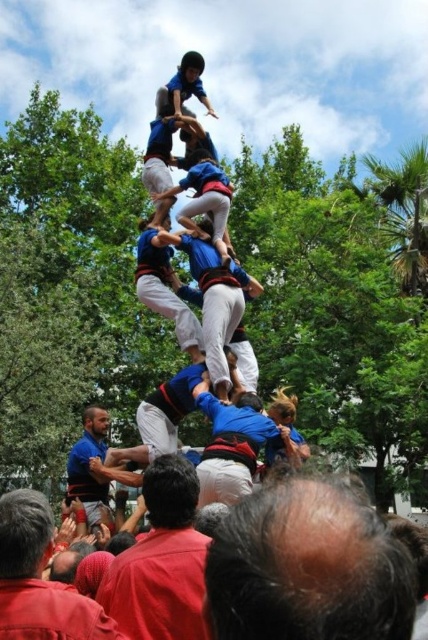
Describe the element at coordinates (162, 561) in the screenshot. This screenshot has width=428, height=640. I see `dark blue shirt at center` at that location.

Is dark blue shirt at center above red shirt at lower left?

Correct, dark blue shirt at center is located above red shirt at lower left.

The image size is (428, 640). I want to click on dark blue shirt at center, so click(162, 561).

Locate an element on the screen. dark blue shirt at center is located at coordinates (162, 561).

In the scene shown: Can you confirm if bald head at center is shorter than blue shirt at center?

Yes, bald head at center is shorter than blue shirt at center.

Does bald head at center appear on the right side of blue shirt at center?

Correct, you'll find bald head at center to the right of blue shirt at center.

I want to click on bald head at center, so click(x=306, y=566).

Does red shirt at lower left lie in front of blue shirt at center?

Yes, it is.

Does red shirt at lower left appear on the right side of blue shirt at center?

Correct, you'll find red shirt at lower left to the right of blue shirt at center.

This screenshot has width=428, height=640. Describe the element at coordinates (39, 579) in the screenshot. I see `red shirt at lower left` at that location.

The height and width of the screenshot is (640, 428). Find the location of `red shirt at lower left`. red shirt at lower left is located at coordinates (39, 579).